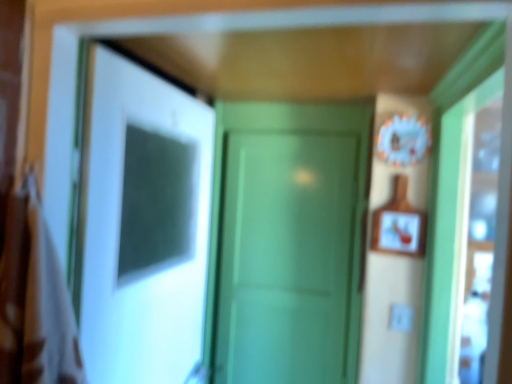
Question: Which direction should I rotate to face green matte door at center, acting as the second door starting from the front, — up or down?

Choices:
 (A) down
 (B) up

Answer: (A)

Question: Could you tell me if wooden framed picture at right is turned towards brown fabric laundry at left?

Choices:
 (A) yes
 (B) no

Answer: (B)

Question: Considering the relative sizes of wooden framed picture at right and brown fabric laundry at left in the image provided, is wooden framed picture at right smaller than brown fabric laundry at left?

Choices:
 (A) yes
 (B) no

Answer: (A)

Question: Is wooden framed picture at right next to brown fabric laundry at left and touching it?

Choices:
 (A) yes
 (B) no

Answer: (B)

Question: From a real-world perspective, is wooden framed picture at right on top of brown fabric laundry at left?

Choices:
 (A) no
 (B) yes

Answer: (B)

Question: Is wooden framed picture at right taller than brown fabric laundry at left?

Choices:
 (A) no
 (B) yes

Answer: (A)

Question: Can you confirm if wooden framed picture at right is shorter than brown fabric laundry at left?

Choices:
 (A) yes
 (B) no

Answer: (A)

Question: Can you confirm if green matte door at center, which appears as the second door when viewed from the left, is smaller than brown fabric laundry at left?

Choices:
 (A) yes
 (B) no

Answer: (B)

Question: Is green matte door at center, arranged as the 1th door when viewed from the right, directly adjacent to brown fabric laundry at left?

Choices:
 (A) yes
 (B) no

Answer: (B)

Question: From the image's perspective, is green matte door at center, which appears as the second door when viewed from the left, below brown fabric laundry at left?

Choices:
 (A) yes
 (B) no

Answer: (A)

Question: From a real-world perspective, does green matte door at center, which is counted as the first door, starting from the back, stand above brown fabric laundry at left?

Choices:
 (A) yes
 (B) no

Answer: (B)

Question: Can you confirm if green matte door at center, which is counted as the first door, starting from the back, is taller than brown fabric laundry at left?

Choices:
 (A) no
 (B) yes

Answer: (B)

Question: Is green matte door at center, arranged as the 1th door when viewed from the right, closer to camera compared to brown fabric laundry at left?

Choices:
 (A) no
 (B) yes

Answer: (A)

Question: Is green matte door at center, acting as the second door starting from the front, not inside wooden framed picture at right?

Choices:
 (A) yes
 (B) no

Answer: (A)